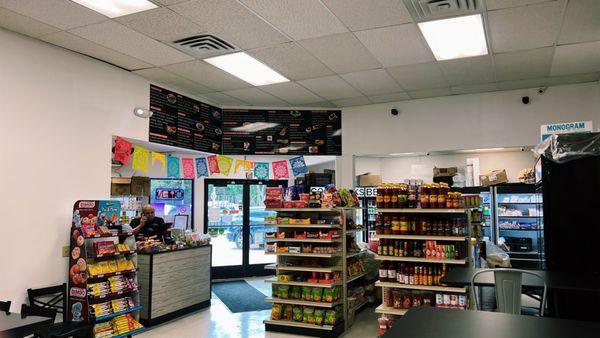
This screenshot has height=338, width=600. Find the location of `cardboard boxes`. cardboard boxes is located at coordinates (494, 176), (370, 178), (451, 170).